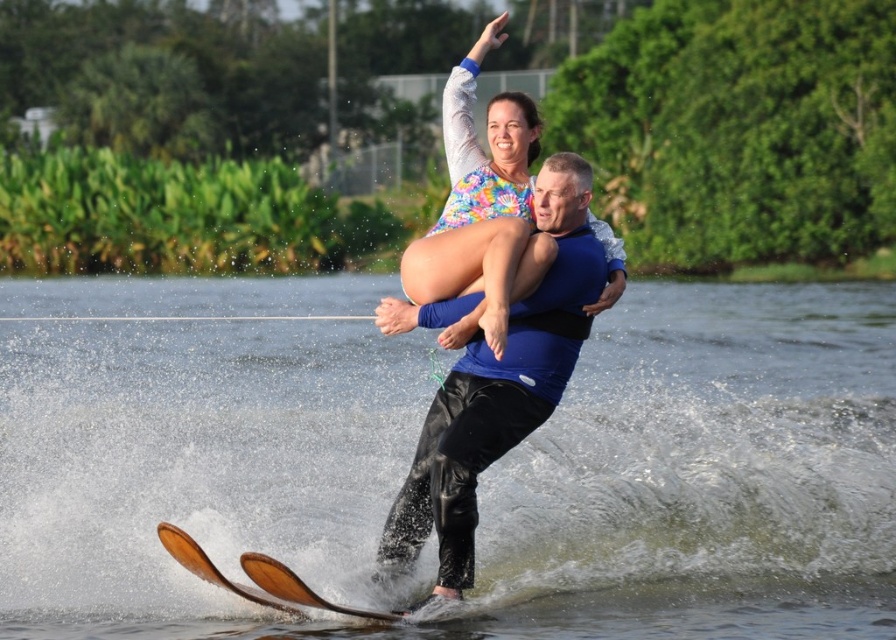
You are a photographer trying to capture the perfect shot of the water skiers. You need to position your camera so that the clear water at skis center and the brown wood water ski at lower center are both visible. Which object should be placed to the right side of your frame?

The clear water at skis center should be placed to the right side of your frame because it is to the right of the brown wood water ski at lower center according to the description.

You are a safety inspector checking the equipment for water skiing. You notice the blue matte life vest at center and the brown wood water ski at lower center. Which equipment has a greater width?

The blue matte life vest at center has a greater width than the brown wood water ski at lower center.